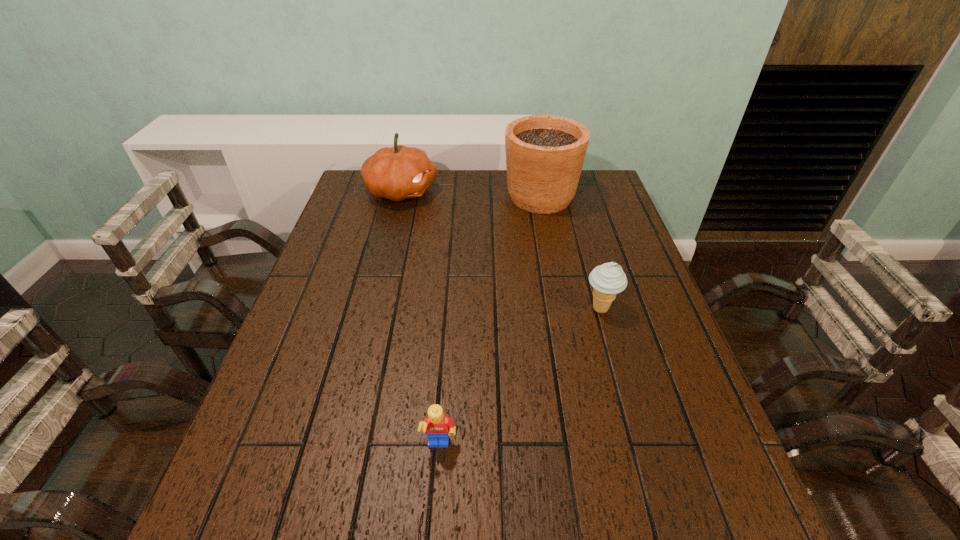
I want to click on vacant point located between the pumpkin and the second nearest object, so click(501, 250).

Where is `vacant area that lies between the third object from right to left and the third farthest object`? The height and width of the screenshot is (540, 960). vacant area that lies between the third object from right to left and the third farthest object is located at coordinates (520, 377).

This screenshot has height=540, width=960. Identify the location of empty space that is in between the icecream and the Lego. (520, 377).

Image resolution: width=960 pixels, height=540 pixels. Find the location of `vacant point located between the flowerpot and the second nearest object`. vacant point located between the flowerpot and the second nearest object is located at coordinates (570, 253).

The image size is (960, 540). Find the location of `object that is the closest to the third farthest object`. object that is the closest to the third farthest object is located at coordinates (545, 154).

Identify the location of object that is the closest to the second object from left to right. (608, 279).

Image resolution: width=960 pixels, height=540 pixels. I want to click on blank area in the image that satisfies the following two spatial constraints: 1. on the front face of the third shortest object; 2. on the right side of the flowerpot, so click(x=400, y=197).

You are a GUI agent. You are given a task and a screenshot of the screen. Output one action in this format:
    pyautogui.click(x=<x>, y=<y>)
    Task: Click on the vacant position in the image that satisfies the following two spatial constraints: 1. on the back side of the third farthest object; 2. on the front face of the pumpkin
    Image resolution: width=960 pixels, height=540 pixels.
    Given the screenshot: What is the action you would take?
    pyautogui.click(x=567, y=191)

Identify the location of vacant space that satisfies the following two spatial constraints: 1. on the back side of the third tallest object; 2. on the front face of the leftmost object. The height and width of the screenshot is (540, 960). (567, 191).

Find the location of a particular element. The width and height of the screenshot is (960, 540). vacant position in the image that satisfies the following two spatial constraints: 1. on the front face of the leftmost object; 2. on the back side of the tallest object is located at coordinates (400, 197).